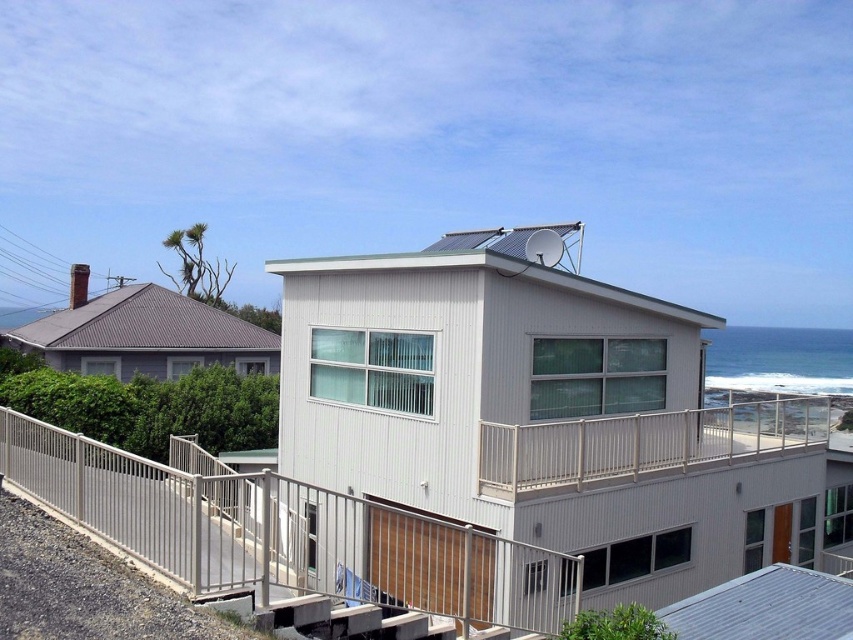
Question: In this image, where is metallic silver railing at lower center located relative to satin silver railing at upper center?

Choices:
 (A) left
 (B) right

Answer: (A)

Question: Considering the relative positions of metallic silver railing at lower center and satin silver railing at upper center in the image provided, where is metallic silver railing at lower center located with respect to satin silver railing at upper center?

Choices:
 (A) left
 (B) right

Answer: (A)

Question: Is metallic silver railing at lower center positioned at the back of satin silver railing at upper center?

Choices:
 (A) no
 (B) yes

Answer: (A)

Question: Which of the following is the closest to the observer?

Choices:
 (A) (450, 586)
 (B) (549, 445)

Answer: (A)